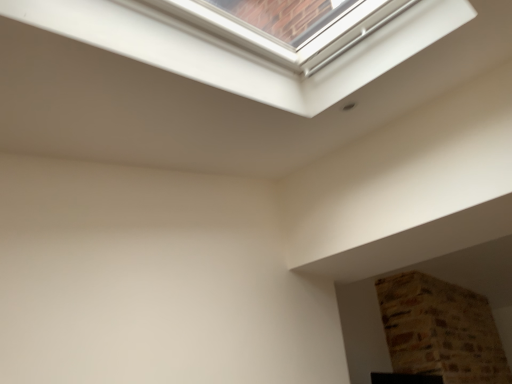
Measure the distance between point (490,315) and camera.

Point (490,315) and camera are 4.36 meters apart.

Describe the element at coordinates (440, 330) in the screenshot. I see `brown stone fireplace at upper right` at that location.

The height and width of the screenshot is (384, 512). What are the coordinates of `brown stone fireplace at upper right` in the screenshot? It's located at (440, 330).

The height and width of the screenshot is (384, 512). Identify the location of brown stone fireplace at upper right. (440, 330).